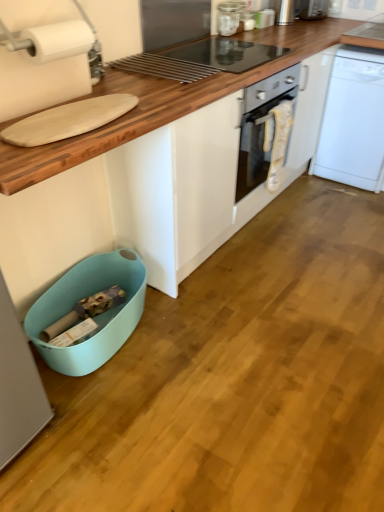
Where is `free spot in front of metallic silver toaster at upper right, the fourth appliance ordered from the bottom`? The width and height of the screenshot is (384, 512). free spot in front of metallic silver toaster at upper right, the fourth appliance ordered from the bottom is located at coordinates (287, 29).